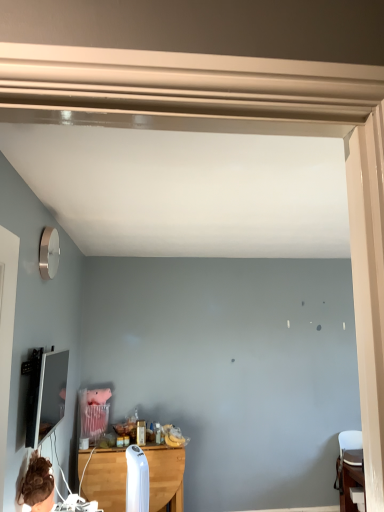
In order to face wooden table at center, the second table when ordered from right to left, should I rotate leftwards or rightwards?

It's best to rotate left around 7.994 degrees.

What do you see at coordinates (350, 479) in the screenshot? I see `wooden table at lower right, positioned as the 1th table in right-to-left order` at bounding box center [350, 479].

Identify the location of wooden table at center, the second table when ordered from right to left. Image resolution: width=384 pixels, height=512 pixels. (106, 479).

Does point (55, 397) appear closer or farther from the camera than point (180, 481)?

Clearly, point (55, 397) is closer to the camera than point (180, 481).

Consider the image. Considering the relative sizes of matte black tv at left and wooden table at center, the second table when ordered from right to left, in the image provided, is matte black tv at left thinner than wooden table at center, the second table when ordered from right to left,?

Correct, the width of matte black tv at left is less than that of wooden table at center, the second table when ordered from right to left.

Is matte black tv at left not near wooden table at center, the first table in the left-to-right sequence?

Yes.

Is point (357, 487) farther from camera compared to point (167, 466)?

No, it is in front of (167, 466).

Is wooden table at lower right, positioned as the 1th table in right-to-left order, with wooden table at center, the first table in the left-to-right sequence?

No, wooden table at lower right, positioned as the 1th table in right-to-left order, is not in contact with wooden table at center, the first table in the left-to-right sequence.

Could you tell me if wooden table at lower right, positioned as the 1th table in right-to-left order, is facing wooden table at center, the second table when ordered from right to left?

No, wooden table at lower right, positioned as the 1th table in right-to-left order, is not turned towards wooden table at center, the second table when ordered from right to left.

Does wooden table at lower right, which appears as the second table when viewed from the left, have a lesser width compared to wooden table at center, the first table in the left-to-right sequence?

Incorrect, the width of wooden table at lower right, which appears as the second table when viewed from the left, is not less than that of wooden table at center, the first table in the left-to-right sequence.

From the image's perspective, who appears lower, wooden table at center, the first table in the left-to-right sequence, or matte black tv at left?

wooden table at center, the first table in the left-to-right sequence, from the image's perspective.

Is wooden table at center, the second table when ordered from right to left, to the right of matte black tv at left from the viewer's perspective?

Indeed, wooden table at center, the second table when ordered from right to left, is positioned on the right side of matte black tv at left.

Is wooden table at center, the second table when ordered from right to left, facing away from matte black tv at left?

wooden table at center, the second table when ordered from right to left, is not turned away from matte black tv at left.

Which point is more forward, (96, 490) or (56, 367)?

The point (56, 367) is more forward.

Is wooden table at lower right, which appears as the second table when viewed from the left, located outside matte black tv at left?

Indeed, wooden table at lower right, which appears as the second table when viewed from the left, is completely outside matte black tv at left.

Which object is more forward, wooden table at lower right, which appears as the second table when viewed from the left, or matte black tv at left?

matte black tv at left is closer to the camera.

Is wooden table at lower right, positioned as the 1th table in right-to-left order, positioned with its back to matte black tv at left?

No, wooden table at lower right, positioned as the 1th table in right-to-left order, is not facing the opposite direction of matte black tv at left.

From the image's perspective, is wooden table at center, the second table when ordered from right to left, located above wooden table at lower right, positioned as the 1th table in right-to-left order?

Yes, from the image's perspective, wooden table at center, the second table when ordered from right to left, is on top of wooden table at lower right, positioned as the 1th table in right-to-left order.

Is wooden table at center, the first table in the left-to-right sequence, not near wooden table at lower right, positioned as the 1th table in right-to-left order?

Absolutely, wooden table at center, the first table in the left-to-right sequence, is distant from wooden table at lower right, positioned as the 1th table in right-to-left order.

Which of these two, wooden table at center, the first table in the left-to-right sequence, or wooden table at lower right, which appears as the second table when viewed from the left, is smaller?

With smaller size is wooden table at lower right, which appears as the second table when viewed from the left.

Is point (164, 450) positioned after point (358, 457)?

Yes, it is behind point (358, 457).

Is matte black tv at left bigger or smaller than wooden table at lower right, positioned as the 1th table in right-to-left order?

In the image, matte black tv at left appears to be smaller than wooden table at lower right, positioned as the 1th table in right-to-left order.

How different are the orientations of matte black tv at left and wooden table at lower right, which appears as the second table when viewed from the left, in degrees?

The facing directions of matte black tv at left and wooden table at lower right, which appears as the second table when viewed from the left, are 91.8 degrees apart.

Does matte black tv at left touch wooden table at lower right, which appears as the second table when viewed from the left?

No, matte black tv at left is not beside wooden table at lower right, which appears as the second table when viewed from the left.

Can you confirm if matte black tv at left is wider than wooden table at lower right, positioned as the 1th table in right-to-left order?

No, matte black tv at left is not wider than wooden table at lower right, positioned as the 1th table in right-to-left order.

Locate an element on the screen. table that is the 1st one when counting rightward from the matte black tv at left is located at coordinates (106, 479).

The height and width of the screenshot is (512, 384). Find the location of `table below the wooden table at center, the first table in the left-to-right sequence (from the image's perspective)`. table below the wooden table at center, the first table in the left-to-right sequence (from the image's perspective) is located at coordinates [350, 479].

Based on their spatial positions, is wooden table at center, the first table in the left-to-right sequence, or matte black tv at left further from wooden table at lower right, which appears as the second table when viewed from the left?

matte black tv at left.

Which object lies nearer to the anchor point matte black tv at left, wooden table at center, the second table when ordered from right to left, or wooden table at lower right, which appears as the second table when viewed from the left?

wooden table at center, the second table when ordered from right to left, is positioned closer to the anchor matte black tv at left.

When comparing their distances from matte black tv at left, does wooden table at lower right, positioned as the 1th table in right-to-left order, or wooden table at center, the second table when ordered from right to left, seem closer?

wooden table at center, the second table when ordered from right to left.

When comparing their distances from wooden table at center, the first table in the left-to-right sequence, does wooden table at lower right, which appears as the second table when viewed from the left, or matte black tv at left seem closer?

matte black tv at left lies closer to wooden table at center, the first table in the left-to-right sequence, than the other object.

Looking at the image, which one is located closer to wooden table at lower right, which appears as the second table when viewed from the left, matte black tv at left or wooden table at center, the second table when ordered from right to left?

wooden table at center, the second table when ordered from right to left, is closer to wooden table at lower right, which appears as the second table when viewed from the left.

Looking at the image, which one is located closer to wooden table at center, the first table in the left-to-right sequence, matte black tv at left or wooden table at lower right, positioned as the 1th table in right-to-left order?

matte black tv at left.

The width and height of the screenshot is (384, 512). What are the coordinates of `table between matte black tv at left and wooden table at lower right, positioned as the 1th table in right-to-left order` in the screenshot? It's located at (106, 479).